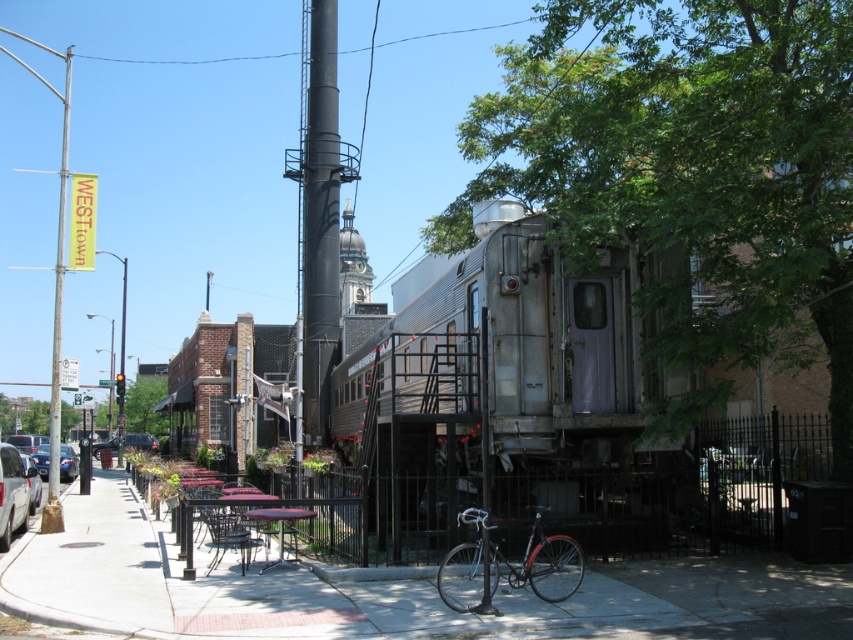
Question: Is black matte pole at center closer to camera compared to matte black car at lower left?

Choices:
 (A) yes
 (B) no

Answer: (A)

Question: Which point is closer to the camera?

Choices:
 (A) black matte pole at center
 (B) matte black car at lower left
 (C) silver metallic train at center
 (D) shiny silver bicycle at center

Answer: (D)

Question: Which object is the farthest from the silver metallic train at center?

Choices:
 (A) black matte pole at center
 (B) concrete sidewalk at lower left
 (C) shiny silver sedan at left
 (D) silver metallic car at lower left

Answer: (C)

Question: Does shiny silver sedan at left lie in front of silver metallic car at left?

Choices:
 (A) no
 (B) yes

Answer: (A)

Question: Which point is farther to the camera?

Choices:
 (A) shiny silver sedan at left
 (B) silver metallic train at center
 (C) silver metallic car at left

Answer: (A)

Question: Can you confirm if silver metallic train at center is wider than black matte pole at center?

Choices:
 (A) no
 (B) yes

Answer: (B)